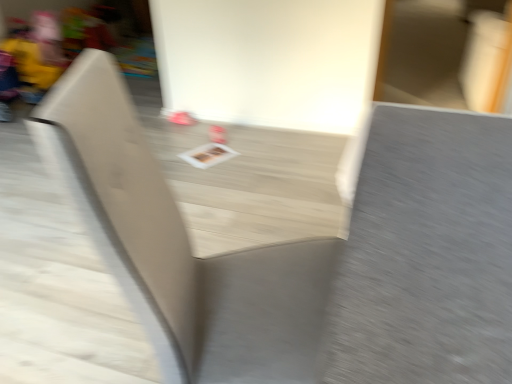
What do you see at coordinates (180, 247) in the screenshot? This screenshot has width=512, height=384. I see `matte gray chair at center` at bounding box center [180, 247].

Identify the location of matte gray chair at center. (180, 247).

Identify the location of matte gray chair at center. This screenshot has height=384, width=512. (180, 247).